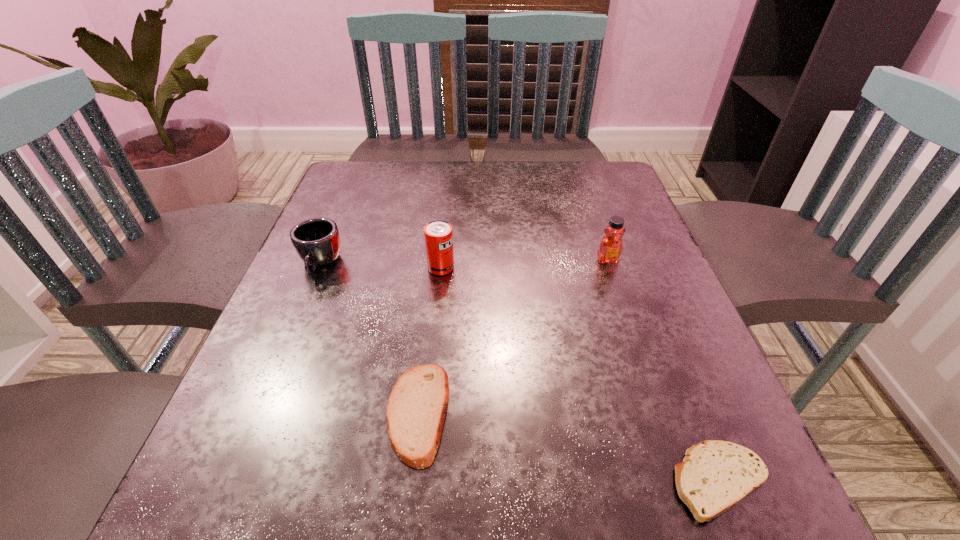
Identify the location of free space between the mug and the shorter pita bread. Image resolution: width=960 pixels, height=540 pixels. [519, 372].

This screenshot has width=960, height=540. I want to click on free point between the right pita bread and the can, so click(580, 374).

Locate an element on the screen. The image size is (960, 540). free space between the right pita bread and the honey is located at coordinates (663, 370).

Where is `the fourth closest object to the can`? the fourth closest object to the can is located at coordinates tap(715, 475).

Locate which object is the third closest to the mug. Please provide its 2D coordinates. Your answer should be formatted as a tuple, i.e. [(x, y)], where the tuple contains the x and y coordinates of a point satisfying the conditions above.

[(611, 246)]

Locate an element on the screen. This screenshot has width=960, height=540. vacant space that satisfies the following two spatial constraints: 1. on the side of the third tallest object with the handle; 2. on the left side of the fourth tallest object is located at coordinates (258, 413).

This screenshot has height=540, width=960. In order to click on free space that satisfies the following two spatial constraints: 1. on the side of the left pita bread with the handle; 2. on the right side of the mug in this screenshot , I will do `click(258, 413)`.

Identify the location of free space that satisfies the following two spatial constraints: 1. on the side of the left pita bread with the handle; 2. on the left side of the third shortest object. (258, 413).

You are a GUI agent. You are given a task and a screenshot of the screen. Output one action in this format:
    pyautogui.click(x=<x>, y=<y>)
    Task: Click on the free space that satisfies the following two spatial constraints: 1. on the back side of the second shortest object; 2. on the right side of the can
    This screenshot has height=540, width=960.
    Given the screenshot: What is the action you would take?
    pyautogui.click(x=435, y=268)

Find the location of a particular element. free space that satisfies the following two spatial constraints: 1. on the side of the right pita bread with the handle; 2. on the left side of the leftmost object is located at coordinates (229, 481).